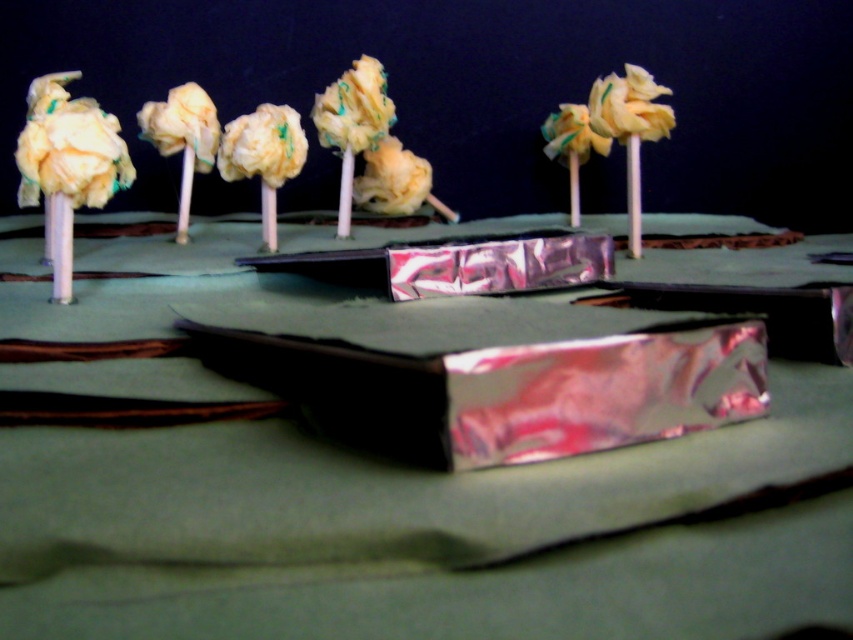
You are setting up a display for a school project and need to place both the metallic silver table at center and the fluffy yellow fabric at center. Which object should you place first if you want the smaller one to be on top?

The fluffy yellow fabric at center is smaller than the metallic silver table at center, so you should place the metallic silver table at center first and then put the fluffy yellow fabric at center on top of it.

You are an observer looking at the miniature landscape model. You notice the white fluffy flower at center and the fluffy yellow fabric at center. Which object is closer to the ground?

The white fluffy flower at center is closer to the ground because it is positioned under the fluffy yellow fabric at center.

You are an observer looking at the miniature landscape model. You notice two yellow fabric flowers in the upper part of the scene. Which one is positioned lower between the matte yellow fabric flower at upper left and the yellow fabric flower at upper center?

The matte yellow fabric flower at upper left is positioned lower than the yellow fabric flower at upper center.